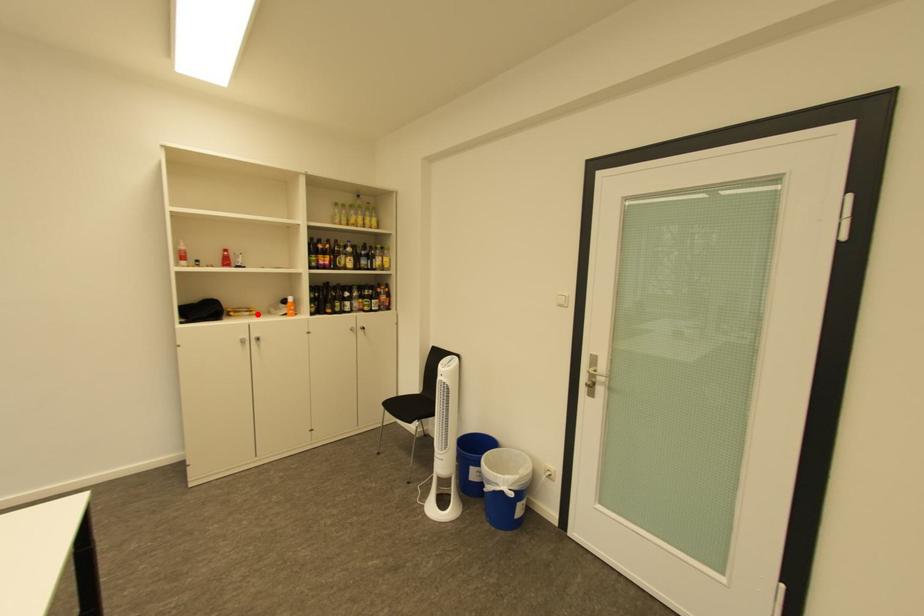
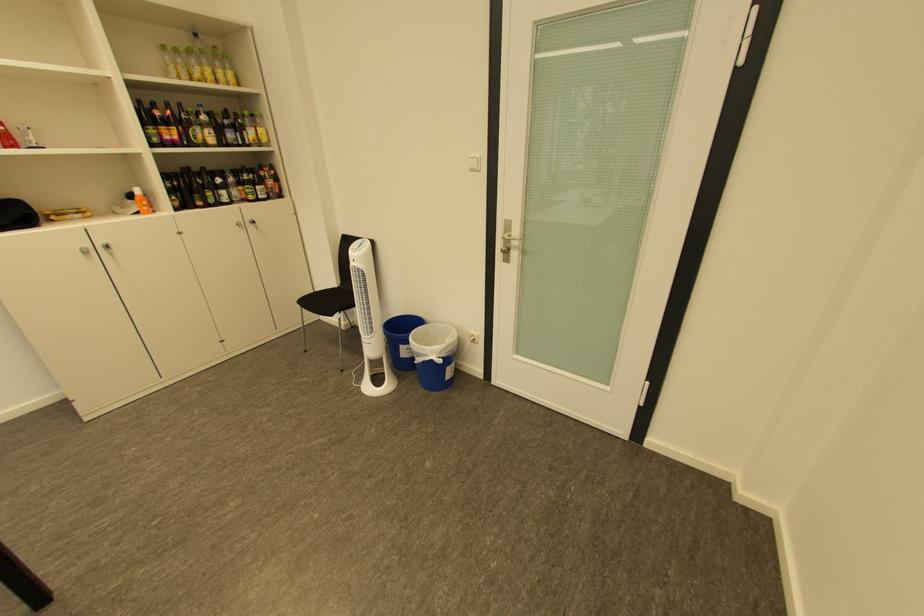
Where in the second image is the point corresponding to the highlighted location from the first image?

(90, 216)